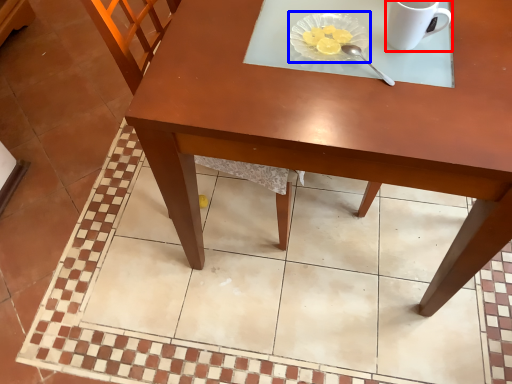
Question: Which of the following is the closest to the observer, coffee cup (highlighted by a red box) or glass plate (highlighted by a blue box)?

Choices:
 (A) coffee cup
 (B) glass plate

Answer: (A)